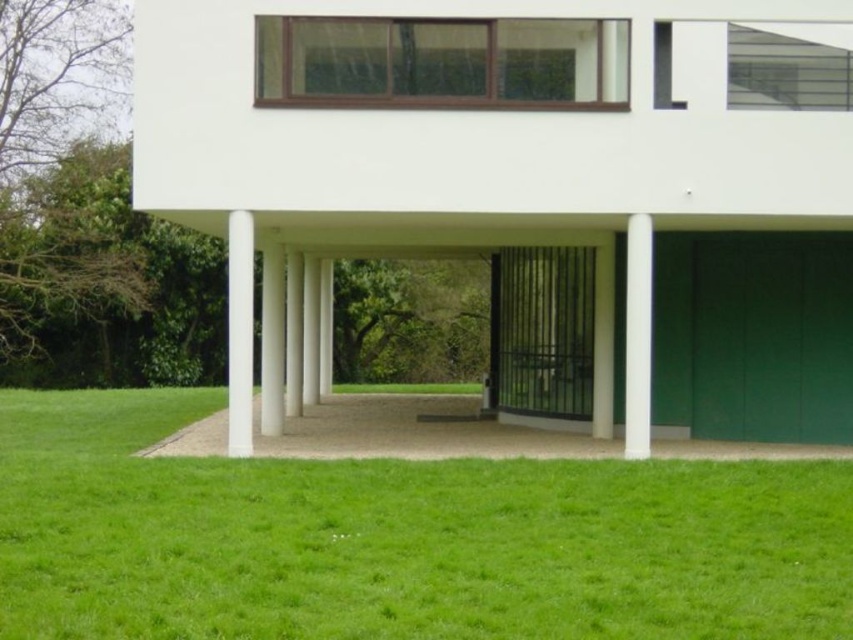
You are standing at the entrance of the modern building and want to walk towards the garden area. There are two points marked on the ground, point (805,141) and point (581,308). Which point should you step on first to reach the garden?

You should step on point (805,141) first because it is in front of point (581,308), meaning it is closer to your current position at the entrance and the garden is beyond it.

In the scene shown: You are standing in front of the modern building and want to enter the white smooth garage at center. To your left, there is a white smooth pillar at center. Which direction should you move to reach the garage?

The white smooth garage at center is to the right of the white smooth pillar at center, so you should move to the right to reach it.